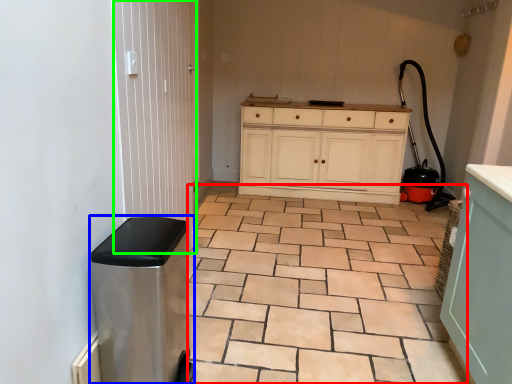
Question: Which is farther away from ceramic tile (highlighted by a red box)? water heater (highlighted by a blue box) or screen door (highlighted by a green box)?

Choices:
 (A) water heater
 (B) screen door

Answer: (B)